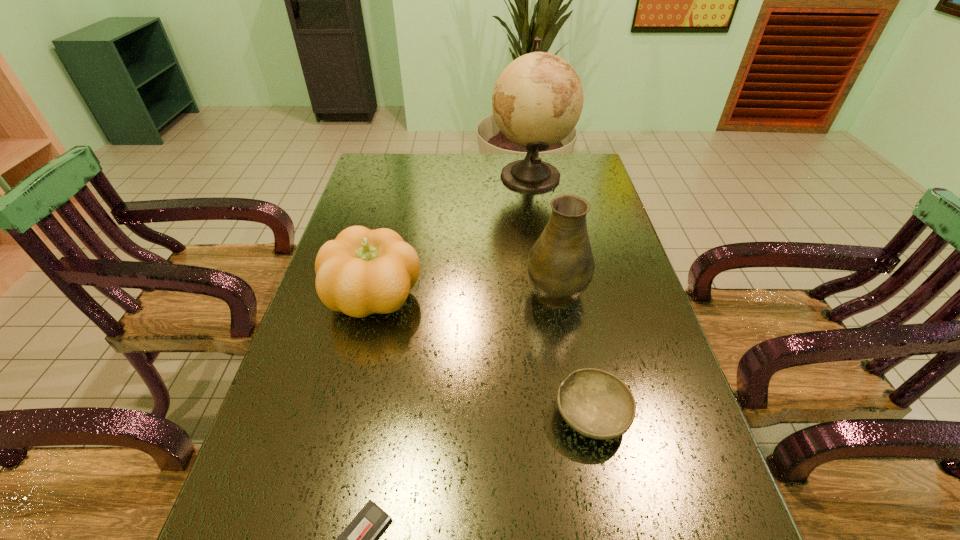
Where is `free space that satisfies the following two spatial constraints: 1. on the front-facing side of the farthest object; 2. on the handle side of the second tallest object`? This screenshot has width=960, height=540. free space that satisfies the following two spatial constraints: 1. on the front-facing side of the farthest object; 2. on the handle side of the second tallest object is located at coordinates coord(548,288).

The height and width of the screenshot is (540, 960). Identify the location of free space that satisfies the following two spatial constraints: 1. on the front-facing side of the globe; 2. on the right side of the bowl. (569, 415).

Locate an element on the screen. Image resolution: width=960 pixels, height=540 pixels. free spot that satisfies the following two spatial constraints: 1. on the front-facing side of the farthest object; 2. on the left side of the second shortest object is located at coordinates (569, 415).

I want to click on free location that satisfies the following two spatial constraints: 1. on the handle side of the fourth shortest object; 2. on the front-facing side of the farthest object, so click(x=536, y=176).